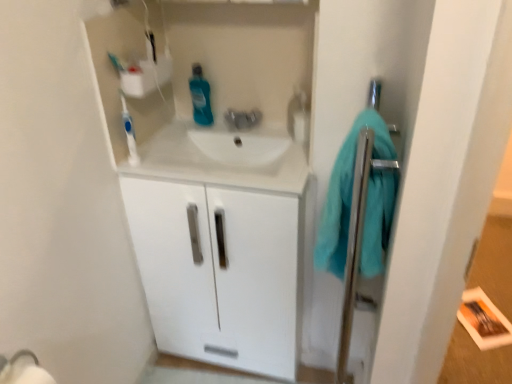
Question: Is blue glossy mouthwash at center bigger than white plastic toothbrush at upper left?

Choices:
 (A) no
 (B) yes

Answer: (B)

Question: Considering the relative positions of blue glossy mouthwash at center and white plastic toothbrush at upper left in the image provided, is blue glossy mouthwash at center to the right of white plastic toothbrush at upper left from the viewer's perspective?

Choices:
 (A) no
 (B) yes

Answer: (B)

Question: Is the surface of blue glossy mouthwash at center in direct contact with white plastic toothbrush at upper left?

Choices:
 (A) no
 (B) yes

Answer: (A)

Question: Considering the relative sizes of blue glossy mouthwash at center and white plastic toothbrush at upper left in the image provided, is blue glossy mouthwash at center shorter than white plastic toothbrush at upper left?

Choices:
 (A) yes
 (B) no

Answer: (A)

Question: Can you confirm if blue glossy mouthwash at center is wider than white plastic toothbrush at upper left?

Choices:
 (A) yes
 (B) no

Answer: (A)

Question: From a real-world perspective, is teal soft towel at right above or below blue glossy mouthwash at center?

Choices:
 (A) below
 (B) above

Answer: (A)

Question: Is point (373, 157) closer or farther from the camera than point (202, 109)?

Choices:
 (A) farther
 (B) closer

Answer: (B)

Question: Based on their positions, is teal soft towel at right located to the left or right of blue glossy mouthwash at center?

Choices:
 (A) left
 (B) right

Answer: (B)

Question: From their relative heights in the image, would you say teal soft towel at right is taller or shorter than blue glossy mouthwash at center?

Choices:
 (A) short
 (B) tall

Answer: (B)

Question: From the image's perspective, is white glossy sink at center above or below white plastic toothbrush at upper left?

Choices:
 (A) below
 (B) above

Answer: (A)

Question: Is point (140, 170) closer or farther from the camera than point (122, 99)?

Choices:
 (A) closer
 (B) farther

Answer: (B)

Question: Considering the relative positions of white glossy sink at center and white plastic toothbrush at upper left in the image provided, is white glossy sink at center to the left or to the right of white plastic toothbrush at upper left?

Choices:
 (A) left
 (B) right

Answer: (B)

Question: In terms of height, does white glossy sink at center look taller or shorter compared to white plastic toothbrush at upper left?

Choices:
 (A) short
 (B) tall

Answer: (A)

Question: Is point (138, 251) closer or farther from the camera than point (214, 165)?

Choices:
 (A) closer
 (B) farther

Answer: (B)

Question: Is white glossy cabinet at center to the left or to the right of white glossy sink at center in the image?

Choices:
 (A) left
 (B) right

Answer: (B)